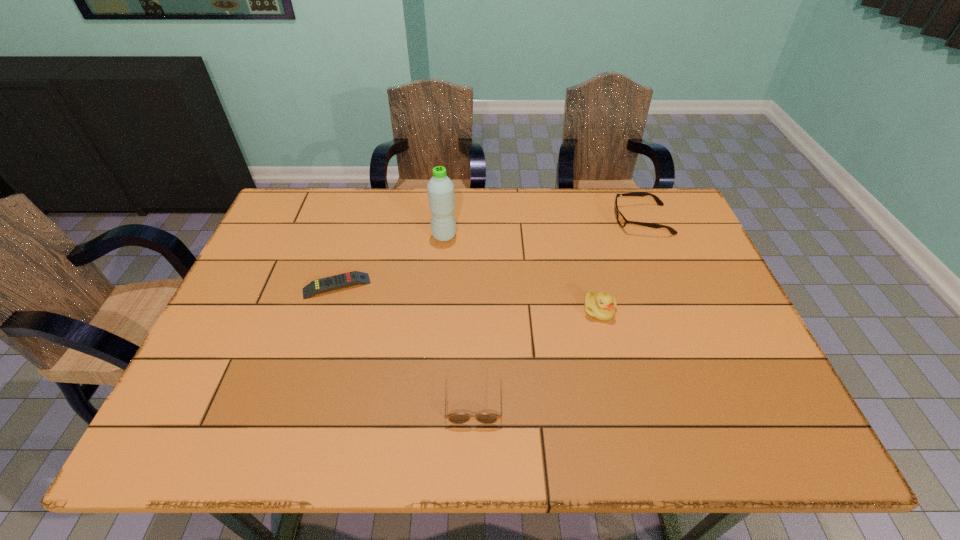
Identify the location of water bottle. The width and height of the screenshot is (960, 540). (440, 188).

This screenshot has width=960, height=540. What are the coordinates of `duckling` in the screenshot? It's located at (601, 306).

Where is `the second object from right to left`? the second object from right to left is located at coordinates coord(601,306).

The height and width of the screenshot is (540, 960). Identify the location of the rightmost object. (622, 221).

Where is `sunglasses`? The image size is (960, 540). sunglasses is located at coordinates (457, 418).

Locate an element on the screen. the fourth tallest object is located at coordinates (457, 418).

The width and height of the screenshot is (960, 540). I want to click on remote control, so click(x=348, y=279).

Locate an element on the screen. The height and width of the screenshot is (540, 960). the shortest object is located at coordinates (348, 279).

The image size is (960, 540). What are the coordinates of `free spot located on the front of the tallest object` in the screenshot? It's located at (439, 299).

Locate an element on the screen. free space located 0.140m on the beak of the fourth shortest object is located at coordinates (613, 370).